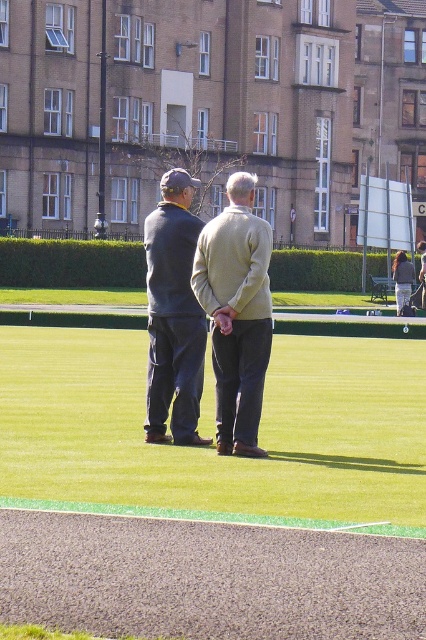
You are a landscape architect designing a walking path between the green grass at center and the light beige sweater at center. The path must be exactly 8 meters long. Can you create such a path based on their current distance?

The distance between the green grass at center and the light beige sweater at center is 8.24 meters. Since the required path length is 8 meters, the path would be slightly shorter than the actual distance between them, so it is not possible to create an 8 meter path that spans the entire distance between them.

You are a fashion designer observing two sweaters displayed on mannequins in a store window. The sweaters are the light beige sweater at center and the dark blue sweater at center. Which sweater would you recommend to a customer who prefers a more lightweight option?

The light beige sweater at center is thinner than the dark blue sweater at center, so it would be the better choice for someone seeking a lightweight option.

You are a photographer trying to capture a photo of the dark blue sweater at center and the green grass at center. Which object is positioned lower in the image?

The green grass at center is positioned below the dark blue sweater at center, so it is lower in the image.